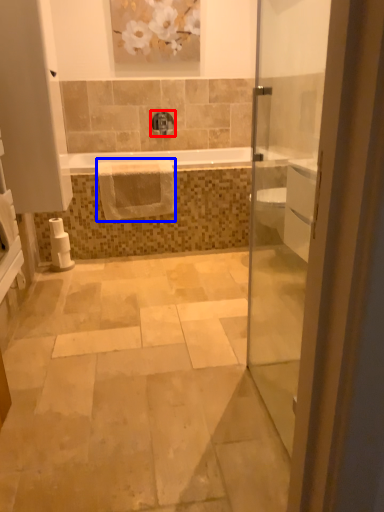
Question: Which point is further to the camera, tap (highlighted by a red box) or hand towel (highlighted by a blue box)?

Choices:
 (A) tap
 (B) hand towel

Answer: (A)